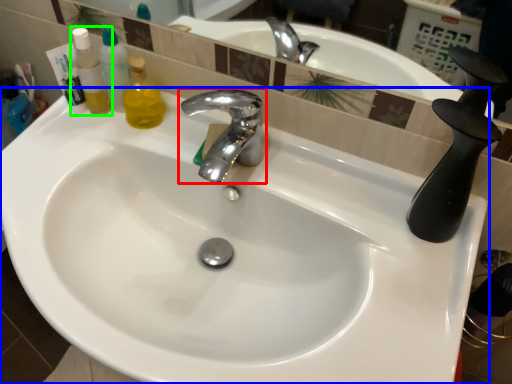
Question: Considering the real-world distances, which object is farthest from tap (highlighted by a red box)? sink (highlighted by a blue box) or mouthwash (highlighted by a green box)?

Choices:
 (A) sink
 (B) mouthwash

Answer: (B)